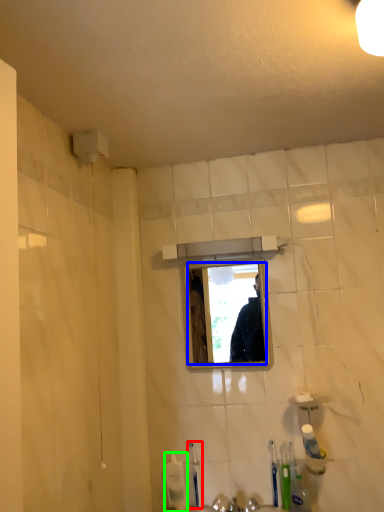
Question: Which object is the closest to the toothbrush (highlighted by a red box)? Choose among these: mirror (highlighted by a blue box) or toiletry (highlighted by a green box).

Choices:
 (A) mirror
 (B) toiletry

Answer: (B)